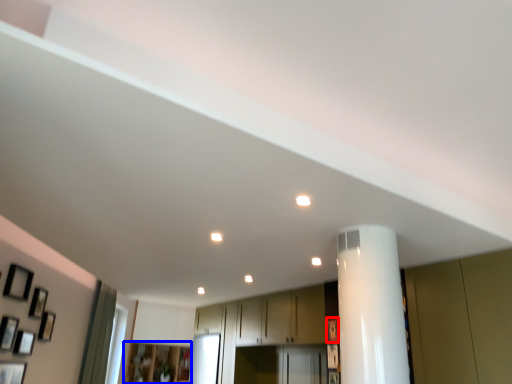
Question: Which object is further to the camera taking this photo, picture frame (highlighted by a red box) or cabinetry (highlighted by a blue box)?

Choices:
 (A) picture frame
 (B) cabinetry

Answer: (B)